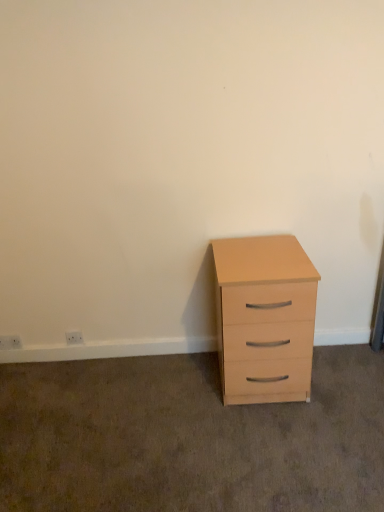
Locate an element on the screen. vacant point to the left of light wood chest of drawers at right is located at coordinates (179, 389).